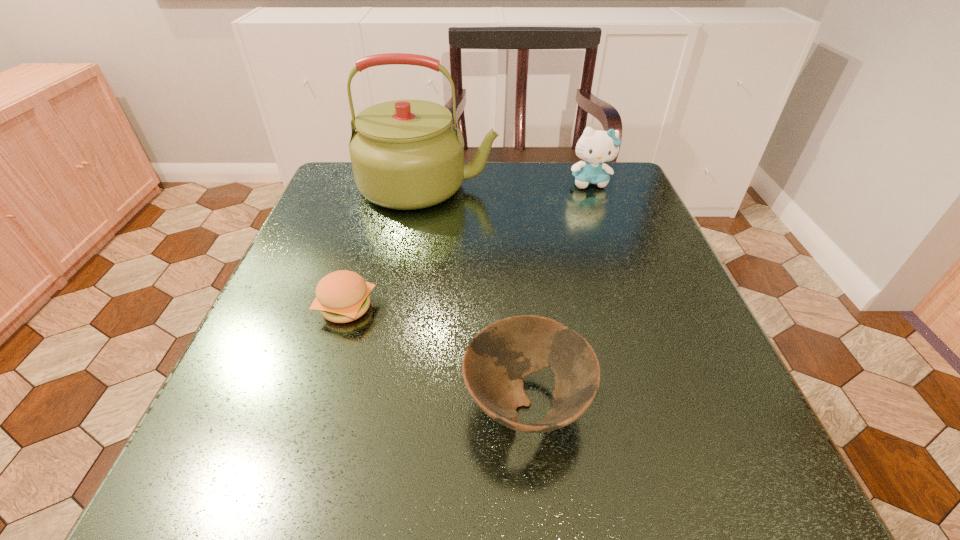
Locate an element on the screen. The image size is (960, 540). the tallest object is located at coordinates (406, 154).

You are a GUI agent. You are given a task and a screenshot of the screen. Output one action in this format:
    pyautogui.click(x=<x>, y=<y>)
    Task: Click on the second tallest object
    
    Given the screenshot: What is the action you would take?
    pyautogui.click(x=595, y=147)

The height and width of the screenshot is (540, 960). I want to click on the rightmost object, so click(595, 147).

Locate an element on the screen. the second shortest object is located at coordinates (496, 360).

Identify the location of bowl. (496, 360).

This screenshot has height=540, width=960. Identify the location of hamburger. [342, 296].

Image resolution: width=960 pixels, height=540 pixels. I want to click on the second nearest object, so click(342, 296).

Identify the location of free space located at the spout of the tallest object. (616, 186).

The width and height of the screenshot is (960, 540). Find the location of `vacant point located on the face of the kitten`. vacant point located on the face of the kitten is located at coordinates (601, 213).

Identify the location of free space located on the left of the nearest object. The height and width of the screenshot is (540, 960). (372, 403).